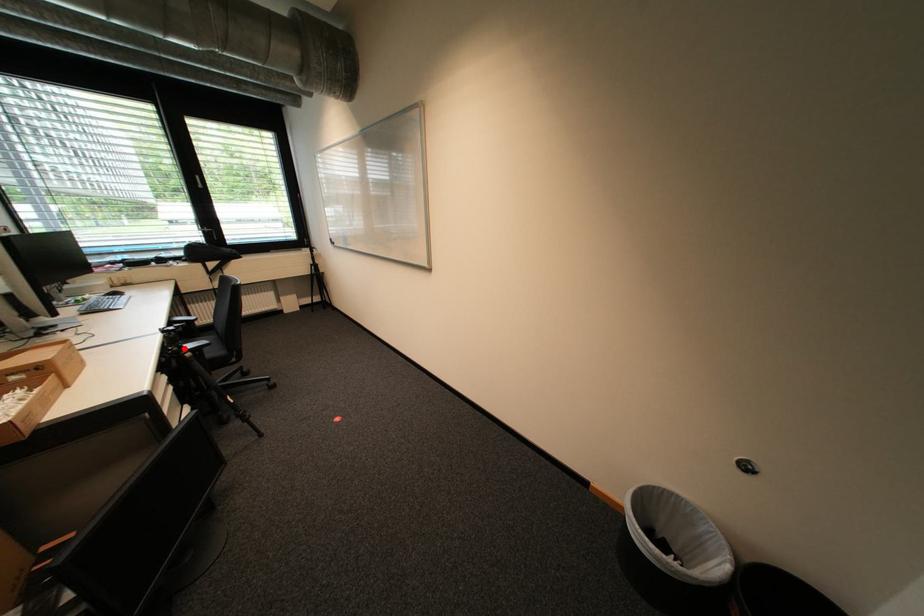
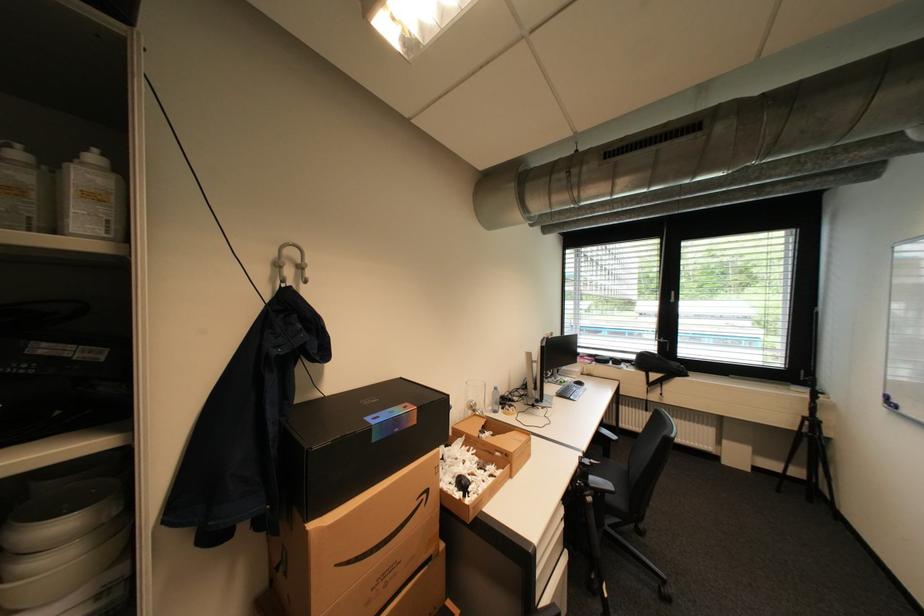
Question: I am providing you with two images of the same scene from different viewpoints. A red point is shown in image1. For the corresponding object point in image2, is it positioned nearer or farther from the camera?

Choices:
 (A) Nearer
 (B) Farther

Answer: (B)